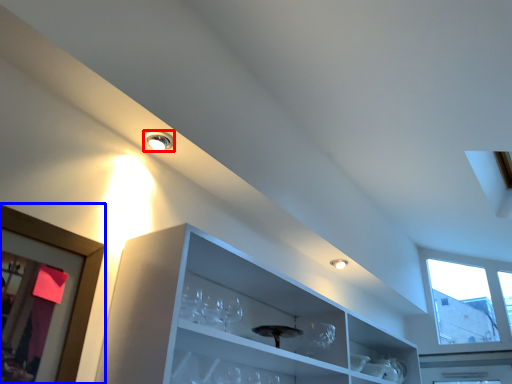
Question: Among these objects, which one is farthest to the camera, droplight (highlighted by a red box) or picture frame (highlighted by a blue box)?

Choices:
 (A) droplight
 (B) picture frame

Answer: (A)